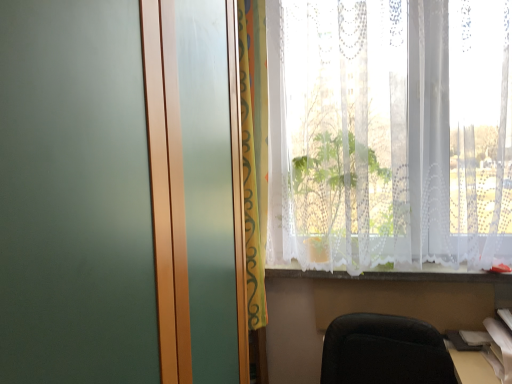
Question: Is multicolored fabric curtain at center surrounding white paper at lower right?

Choices:
 (A) yes
 (B) no

Answer: (B)

Question: Considering the relative sizes of multicolored fabric curtain at center and white paper at lower right in the image provided, is multicolored fabric curtain at center shorter than white paper at lower right?

Choices:
 (A) no
 (B) yes

Answer: (A)

Question: Is multicolored fabric curtain at center next to white paper at lower right and touching it?

Choices:
 (A) no
 (B) yes

Answer: (A)

Question: Considering the relative sizes of multicolored fabric curtain at center and white paper at lower right in the image provided, is multicolored fabric curtain at center thinner than white paper at lower right?

Choices:
 (A) yes
 (B) no

Answer: (B)

Question: Is there a large distance between multicolored fabric curtain at center and white paper at lower right?

Choices:
 (A) no
 (B) yes

Answer: (B)

Question: Considering the positions of white paper at lower right and white lace curtain at upper right in the image, is white paper at lower right wider or thinner than white lace curtain at upper right?

Choices:
 (A) wide
 (B) thin

Answer: (B)

Question: Which is correct: white paper at lower right is inside white lace curtain at upper right, or outside of it?

Choices:
 (A) inside
 (B) outside

Answer: (B)

Question: In the image, is white paper at lower right on the left side or the right side of white lace curtain at upper right?

Choices:
 (A) right
 (B) left

Answer: (A)

Question: Based on their sizes in the image, would you say white paper at lower right is bigger or smaller than white lace curtain at upper right?

Choices:
 (A) small
 (B) big

Answer: (A)

Question: Relative to white lace curtain at lower center, is white lace curtain at upper right in front or behind?

Choices:
 (A) behind
 (B) front

Answer: (B)

Question: Is white lace curtain at upper right wider or thinner than white lace curtain at lower center?

Choices:
 (A) wide
 (B) thin

Answer: (A)

Question: Considering the positions of white lace curtain at upper right and white lace curtain at lower center in the image, is white lace curtain at upper right bigger or smaller than white lace curtain at lower center?

Choices:
 (A) big
 (B) small

Answer: (A)

Question: Is white lace curtain at upper right inside or outside of white lace curtain at lower center?

Choices:
 (A) outside
 (B) inside

Answer: (A)

Question: Is white paper at lower right in front of or behind multicolored fabric curtain at center in the image?

Choices:
 (A) front
 (B) behind

Answer: (A)

Question: Looking at their shapes, would you say white paper at lower right is wider or thinner than multicolored fabric curtain at center?

Choices:
 (A) wide
 (B) thin

Answer: (B)